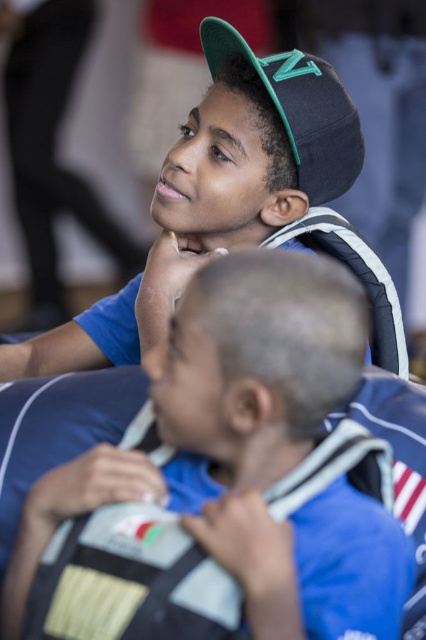
Is blue fabric shirt at center wider than matte black cap at upper center?

No, blue fabric shirt at center is not wider than matte black cap at upper center.

Is blue fabric shirt at center closer to camera compared to matte black cap at upper center?

Yes, it is.

Is point (259, 451) positioned before point (54, 372)?

Yes, it is in front of point (54, 372).

The width and height of the screenshot is (426, 640). What are the coordinates of `blue fabric shirt at center` in the screenshot? It's located at (250, 451).

From the picture: Is matte black cap at upper center thinner than black matte baseball cap at upper center?

No.

Does matte black cap at upper center appear on the right side of black matte baseball cap at upper center?

In fact, matte black cap at upper center is to the left of black matte baseball cap at upper center.

Find the location of a particular element. The height and width of the screenshot is (640, 426). matte black cap at upper center is located at coordinates (236, 205).

Does blue fabric shirt at center lie behind black matte baseball cap at upper center?

That is False.

Is blue fabric shirt at center to the left of black matte baseball cap at upper center from the viewer's perspective?

Indeed, blue fabric shirt at center is positioned on the left side of black matte baseball cap at upper center.

From the picture: Who is more distant from viewer, (321, 419) or (287, 104)?

Point (287, 104)

This screenshot has width=426, height=640. Find the location of `blue fabric shirt at center`. blue fabric shirt at center is located at coordinates (250, 451).